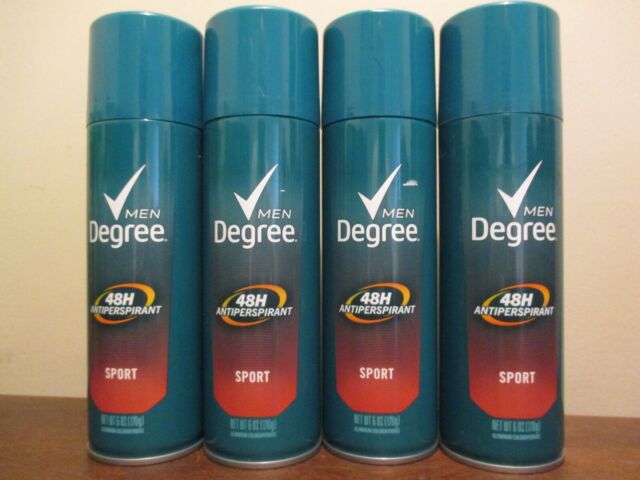
Locate an element on the screen. This screenshot has height=480, width=640. wall is located at coordinates (77, 368).